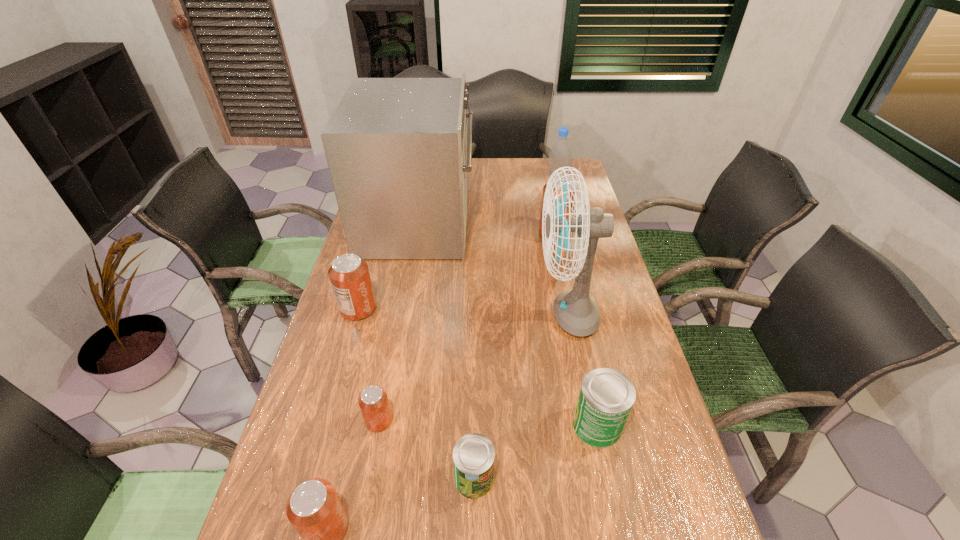
You are a GUI agent. You are given a task and a screenshot of the screen. Output one action in this format:
    pyautogui.click(x=<x>, y=<y>)
    Task: Click on the free point located 0.350m on the left of the right green can
    The width and height of the screenshot is (960, 540).
    Given the screenshot: What is the action you would take?
    pyautogui.click(x=423, y=425)

I want to click on vacant space situated on the left of the smaller green can, so click(343, 478).

Where is `vacant space located on the front of the second nearest orange can`? vacant space located on the front of the second nearest orange can is located at coordinates (360, 522).

Where is `object that is at the far edge`? object that is at the far edge is located at coordinates (560, 155).

Find the location of a particular element. toaster oven that is positioned at the left edge is located at coordinates (397, 151).

Locate an element on the screen. This screenshot has height=540, width=960. can at the left edge is located at coordinates (349, 275).

At what (x,y) coordinates should I click in order to perform the action: click on fan present at the right edge. Please return your answer as a coordinate pair (x, y). The height and width of the screenshot is (540, 960). Looking at the image, I should click on (576, 312).

Identify the location of bottle at the right edge. The height and width of the screenshot is (540, 960). pyautogui.click(x=560, y=155).

Locate an element on the screen. object present at the far right corner is located at coordinates (560, 155).

You are a GUI agent. You are given a task and a screenshot of the screen. Output one action in this format:
    pyautogui.click(x=<x>, y=<y>)
    Task: Click on the vacant space at the far edge of the desktop
    This screenshot has width=960, height=540.
    Given the screenshot: What is the action you would take?
    pyautogui.click(x=492, y=163)